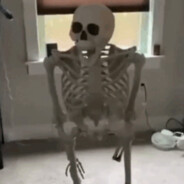
You are a GUI agent. You are given a task and a screenshot of the screen. Output one action in this format:
    pyautogui.click(x=<x>, y=<y>)
    Task: Click on the window shade
    Image resolution: width=184 pixels, height=184 pixels.
    Given the screenshot: What is the action you would take?
    pyautogui.click(x=66, y=4)